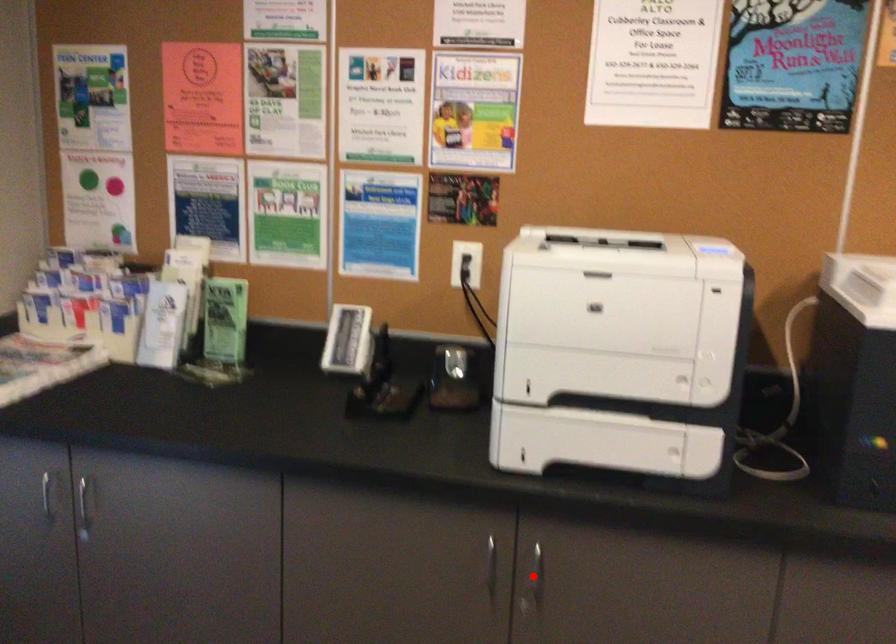
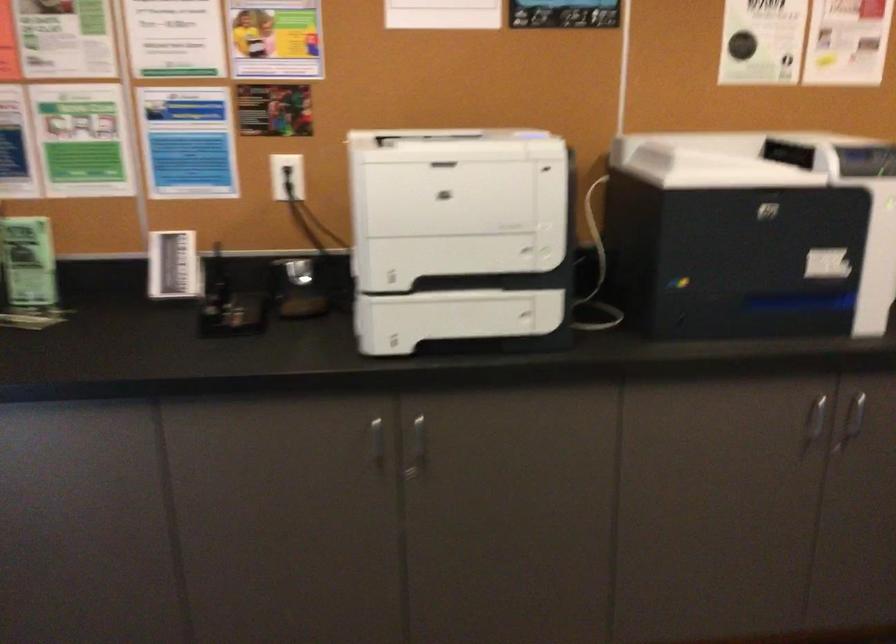
Question: I am providing you with two images of the same scene from different viewpoints. Image1 has a red point marked. In image2, the corresponding 3D location appears at what relative position? Reply with the corresponding letter.

Choices:
 (A) Closer
 (B) Farther

Answer: (B)